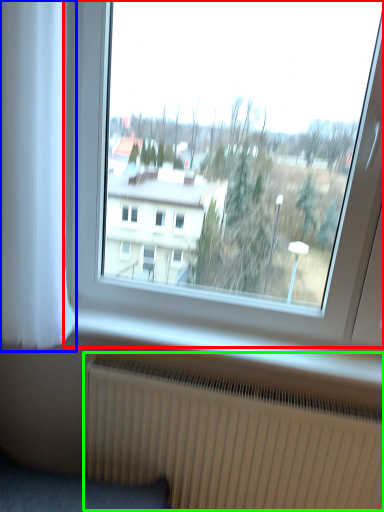
Question: Considering the real-world distances, which object is farthest from window (highlighted by a red box)? curtain (highlighted by a blue box) or radiator (highlighted by a green box)?

Choices:
 (A) curtain
 (B) radiator

Answer: (A)